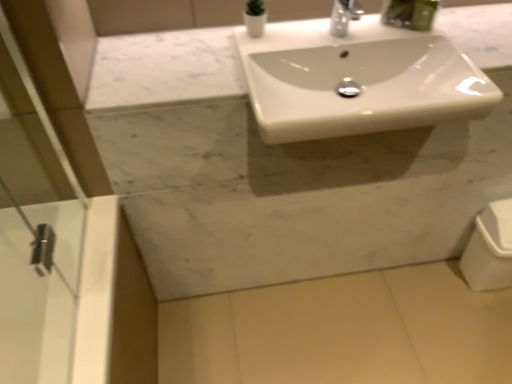
This screenshot has height=384, width=512. Identify the location of vacant area that lies to the right of white glossy vase at upper center. (298, 29).